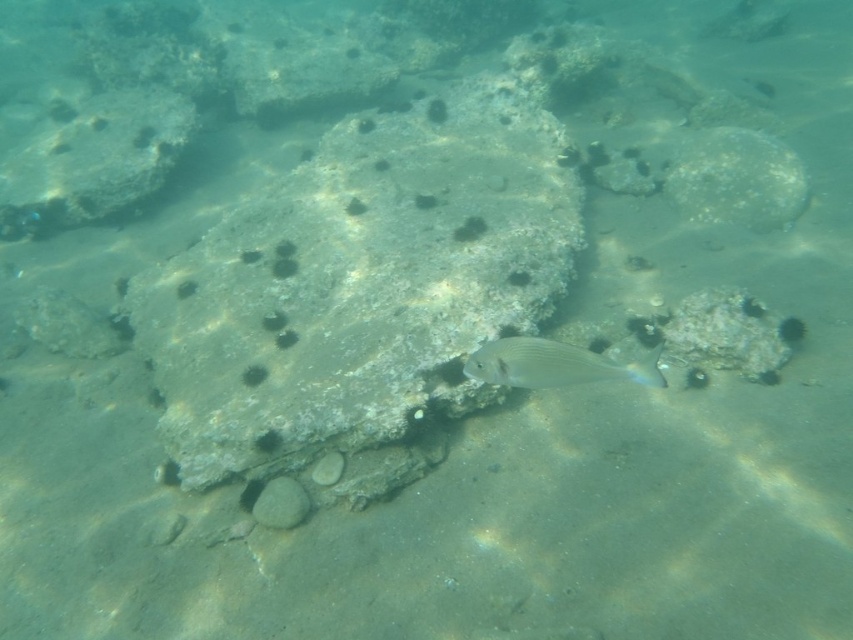
Question: Which point is closer to the camera?

Choices:
 (A) silvery metallic fish at center
 (B) smooth gray rock at upper right

Answer: (A)

Question: Is smooth gray rock at upper right closer to camera compared to silvery metallic fish at center?

Choices:
 (A) yes
 (B) no

Answer: (B)

Question: Which point is farther from the camera taking this photo?

Choices:
 (A) (711, 189)
 (B) (376, 413)
 (C) (508, 346)

Answer: (A)

Question: Which point is farther to the camera?

Choices:
 (A) smooth gray rock at upper right
 (B) gray rock at center
 (C) silvery metallic fish at center

Answer: (A)

Question: Observing the image, what is the correct spatial positioning of gray rock at center in reference to smooth gray rock at upper right?

Choices:
 (A) above
 (B) below

Answer: (B)

Question: Where is smooth gray rock at upper right located in relation to silvery metallic fish at center in the image?

Choices:
 (A) left
 (B) right

Answer: (B)